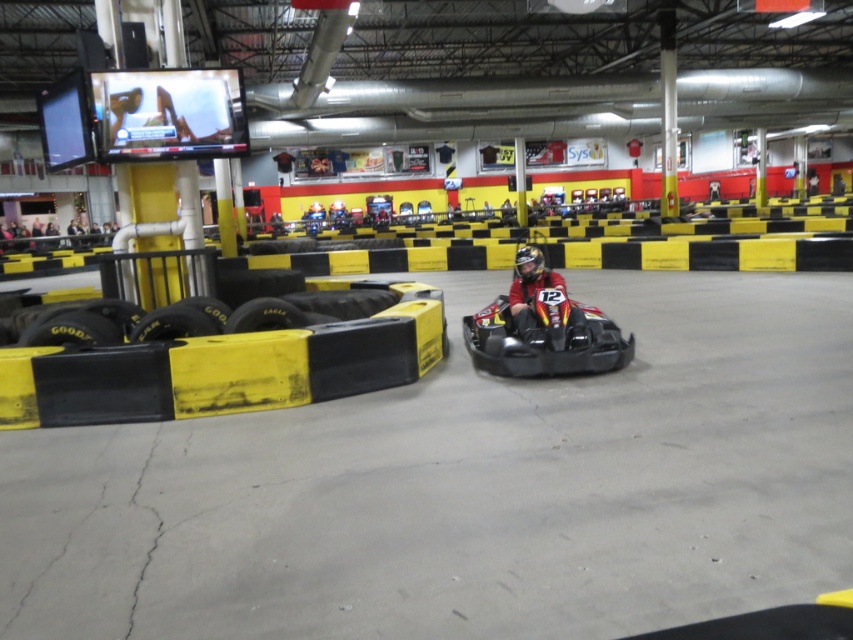
Question: Is red leather helmet at center wider than black matte helmet at center?

Choices:
 (A) yes
 (B) no

Answer: (A)

Question: Is the position of yellow rubber tire at left less distant than that of black rubber tire at lower left?

Choices:
 (A) no
 (B) yes

Answer: (B)

Question: Which of the following is the farthest from the observer?

Choices:
 (A) (332, 305)
 (B) (572, 314)
 (C) (524, 288)

Answer: (A)

Question: Which point is farther to the camera?

Choices:
 (A) (492, 342)
 (B) (519, 250)
 (C) (235, 314)

Answer: (B)

Question: Estimate the real-world distances between objects in this image. Which object is farther from the black matte helmet at center?

Choices:
 (A) black rubber tire at lower left
 (B) black matte go-kart at center
 (C) black rubber tire at center

Answer: (C)

Question: Is yellow rubber tire at lower left to the left of black matte helmet at center from the viewer's perspective?

Choices:
 (A) no
 (B) yes

Answer: (B)